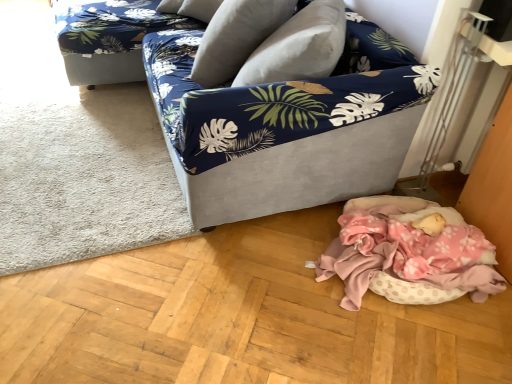
Question: Is pink polka dot fabric at lower right facing away from white soft rug at lower left?

Choices:
 (A) yes
 (B) no

Answer: (B)

Question: Does pink polka dot fabric at lower right have a greater height compared to white soft rug at lower left?

Choices:
 (A) no
 (B) yes

Answer: (B)

Question: From a real-world perspective, is pink polka dot fabric at lower right on top of white soft rug at lower left?

Choices:
 (A) no
 (B) yes

Answer: (B)

Question: Would you say pink polka dot fabric at lower right is a long distance from white soft rug at lower left?

Choices:
 (A) yes
 (B) no

Answer: (A)

Question: Is pink polka dot fabric at lower right at the left side of white soft rug at lower left?

Choices:
 (A) yes
 (B) no

Answer: (B)

Question: Is point (51, 253) closer or farther from the camera than point (356, 147)?

Choices:
 (A) farther
 (B) closer

Answer: (B)

Question: Considering their positions, is white soft rug at lower left located in front of or behind velvet fabric couch at center?

Choices:
 (A) front
 (B) behind

Answer: (B)

Question: From a real-world perspective, is white soft rug at lower left physically located above or below velvet fabric couch at center?

Choices:
 (A) below
 (B) above

Answer: (A)

Question: Based on their sizes in the image, would you say white soft rug at lower left is bigger or smaller than velvet fabric couch at center?

Choices:
 (A) big
 (B) small

Answer: (B)

Question: Is point (415, 71) positioned closer to the camera than point (154, 6)?

Choices:
 (A) closer
 (B) farther

Answer: (A)

Question: Considering the positions of velvet fabric couch at center and blue floral fabric couch at upper left in the image, is velvet fabric couch at center wider or thinner than blue floral fabric couch at upper left?

Choices:
 (A) thin
 (B) wide

Answer: (A)

Question: From a real-world perspective, is velvet fabric couch at center positioned above or below blue floral fabric couch at upper left?

Choices:
 (A) below
 (B) above

Answer: (B)

Question: Relative to blue floral fabric couch at upper left, is velvet fabric couch at center in front or behind?

Choices:
 (A) behind
 (B) front

Answer: (B)

Question: Based on their positions, is white soft rug at lower left located to the left or right of blue floral fabric couch at upper left?

Choices:
 (A) right
 (B) left

Answer: (B)

Question: From the image's perspective, is white soft rug at lower left positioned above or below blue floral fabric couch at upper left?

Choices:
 (A) above
 (B) below

Answer: (B)